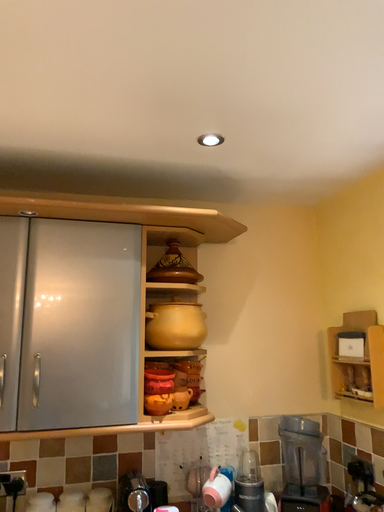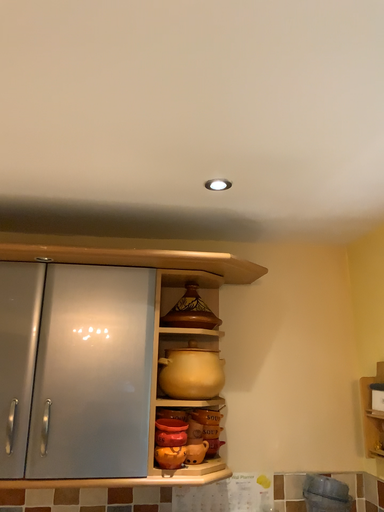
Question: How did the camera likely rotate when shooting the video?

Choices:
 (A) rotated left
 (B) rotated right

Answer: (A)